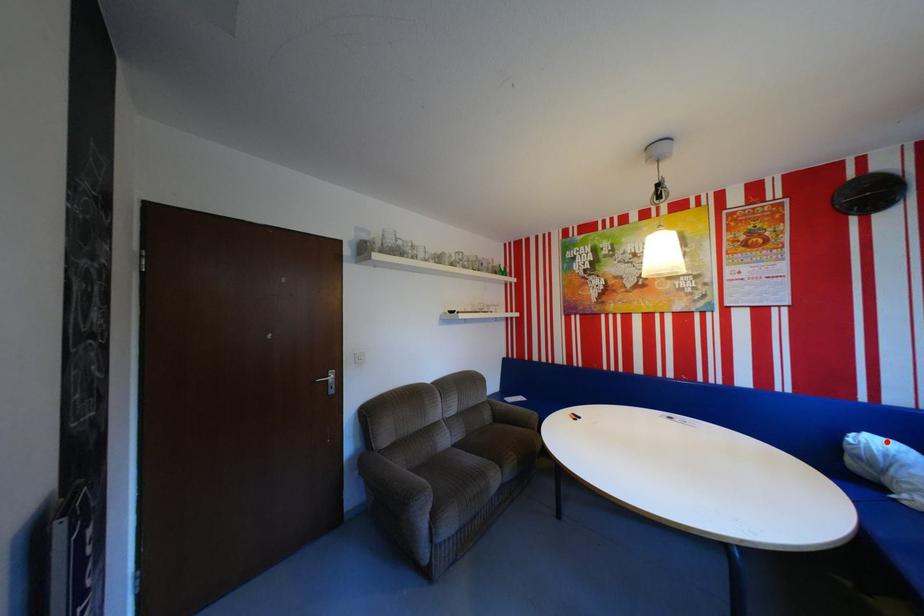
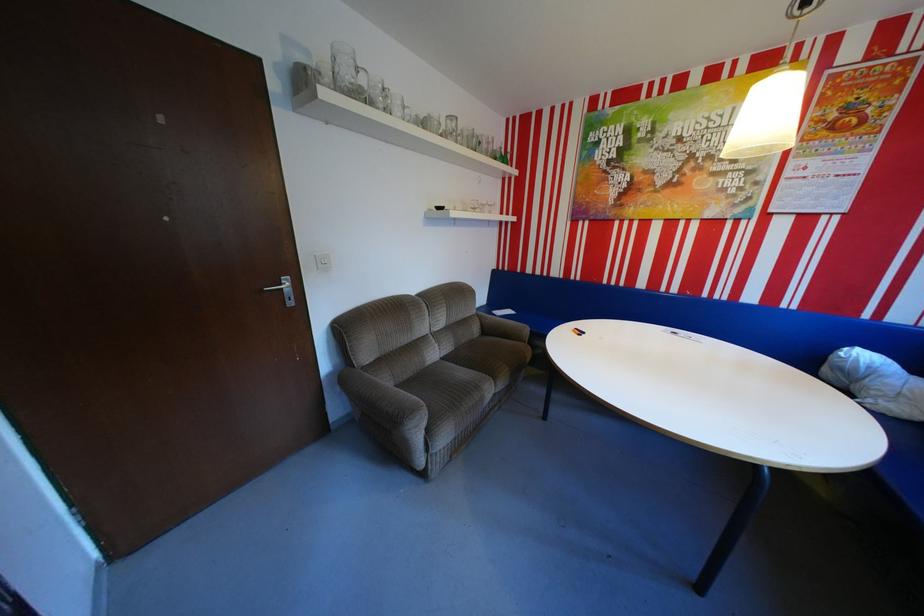
The point at the highlighted location is marked in the first image. Where is the corresponding point in the second image?

(874, 355)